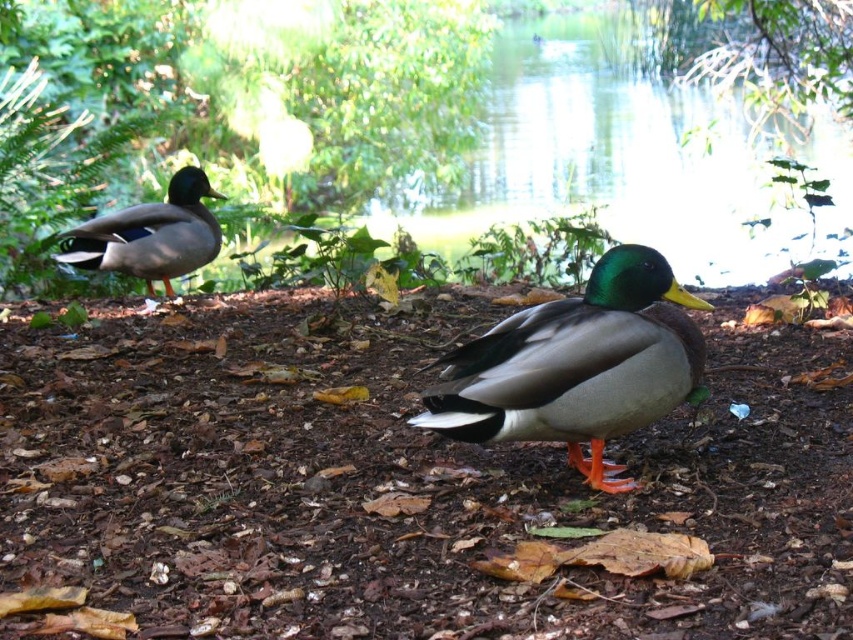
You are a birdwatcher observing two ducks in the scene. The green glossy duck at center and the shiny green duck at left. Which duck is smaller in size?

The green glossy duck at center is smaller in size compared to the shiny green duck at left.